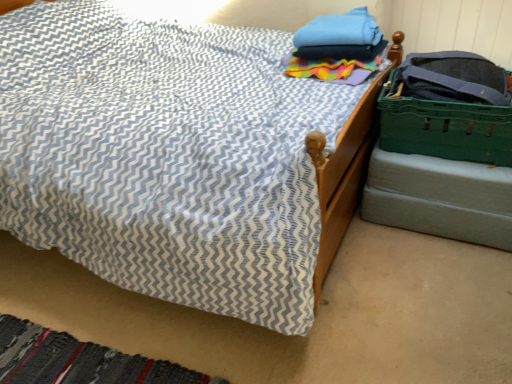
You are a GUI agent. You are given a task and a screenshot of the screen. Output one action in this format:
    pyautogui.click(x=<x>, y=<y>)
    Task: Click on the textured fabric bed at center
    This screenshot has height=384, width=512.
    Given the screenshot: What is the action you would take?
    pyautogui.click(x=166, y=155)

Does blue cotton towels at upper right turn towards green plastic crate at lower right?

No.

From a real-world perspective, between blue cotton towels at upper right and green plastic crate at lower right, who is vertically higher?

blue cotton towels at upper right.

Looking at this image, is blue cotton towels at upper right completely or partially outside of green plastic crate at lower right?

Yes, blue cotton towels at upper right is not within green plastic crate at lower right.

Image resolution: width=512 pixels, height=384 pixels. In order to click on clothing above the green plastic crate at lower right (from a real-world perspective) in this screenshot , I will do `click(337, 48)`.

Are green plastic crate at right and green plastic crate at lower right located far from each other?

No, green plastic crate at right is not far from green plastic crate at lower right.

Is green plastic crate at right inside or outside of green plastic crate at lower right?

green plastic crate at right exists outside the volume of green plastic crate at lower right.

Does green plastic crate at right turn towards green plastic crate at lower right?

No, green plastic crate at right does not turn towards green plastic crate at lower right.

Is point (510, 79) farther from viewer compared to point (433, 205)?

No, (510, 79) is in front of (433, 205).

Would you consider green plastic crate at lower right to be distant from textured fabric bed at center?

That's not correct — green plastic crate at lower right is a little close to textured fabric bed at center.

From a real-world perspective, between green plastic crate at lower right and textured fabric bed at center, who is vertically higher?

green plastic crate at lower right.

Is green plastic crate at lower right facing towards textured fabric bed at center?

No.

Is blue cotton towels at upper right turned away from textured fabric bed at center?

No, textured fabric bed at center is not at the back of blue cotton towels at upper right.

From the picture: Is blue cotton towels at upper right situated inside textured fabric bed at center or outside?

blue cotton towels at upper right exists outside the volume of textured fabric bed at center.

Does blue cotton towels at upper right appear on the right side of textured fabric bed at center?

Indeed, blue cotton towels at upper right is positioned on the right side of textured fabric bed at center.

From the image's perspective, is blue cotton towels at upper right on textured fabric bed at center?

Yes.

Does point (403, 101) come behind point (326, 68)?

No, (403, 101) is in front of (326, 68).

Can you confirm if green plastic crate at right is shorter than blue cotton towels at upper right?

Incorrect, the height of green plastic crate at right does not fall short of that of blue cotton towels at upper right.

Is green plastic crate at right with blue cotton towels at upper right?

green plastic crate at right and blue cotton towels at upper right are clearly separated.

From the image's perspective, is green plastic crate at right located above blue cotton towels at upper right?

No, from the image's perspective, green plastic crate at right is not on top of blue cotton towels at upper right.

Is the position of textured fabric bed at center more distant than that of blue cotton towels at upper right?

No, it is in front of blue cotton towels at upper right.

From the image's perspective, does textured fabric bed at center appear lower than blue cotton towels at upper right?

Correct, textured fabric bed at center appears lower than blue cotton towels at upper right in the image.

Is textured fabric bed at center aimed at blue cotton towels at upper right?

No, textured fabric bed at center is not facing towards blue cotton towels at upper right.

Is textured fabric bed at center inside or outside of blue cotton towels at upper right?

textured fabric bed at center is not inside blue cotton towels at upper right, it's outside.

Considering the sizes of objects textured fabric bed at center and green plastic crate at lower right in the image provided, who is thinner, textured fabric bed at center or green plastic crate at lower right?

With smaller width is green plastic crate at lower right.

Is textured fabric bed at center not inside green plastic crate at lower right?

textured fabric bed at center is positioned outside green plastic crate at lower right.

Is textured fabric bed at center aimed at green plastic crate at lower right?

No, textured fabric bed at center is not turned towards green plastic crate at lower right.

Identify the location of clothing on the left of the green plastic crate at lower right. (337, 48).

Locate an element on the screen. The height and width of the screenshot is (384, 512). bed frame that appears below the green plastic crate at right (from a real-world perspective) is located at coordinates (440, 198).

Based on their spatial positions, is green plastic crate at right or textured fabric bed at center further from green plastic crate at lower right?

textured fabric bed at center.

From the image, which object appears to be nearer to textured fabric bed at center, blue cotton towels at upper right or green plastic crate at right?

blue cotton towels at upper right is positioned closer to the anchor textured fabric bed at center.

From the image, which object appears to be farther from textured fabric bed at center, green plastic crate at lower right or blue cotton towels at upper right?

Based on the image, green plastic crate at lower right appears to be further to textured fabric bed at center.

Which object lies nearer to the anchor point textured fabric bed at center, green plastic crate at right or green plastic crate at lower right?

green plastic crate at right is positioned closer to the anchor textured fabric bed at center.

When comparing their distances from green plastic crate at right, does textured fabric bed at center or green plastic crate at lower right seem closer?

green plastic crate at lower right is closer to green plastic crate at right.

Which object lies further to the anchor point blue cotton towels at upper right, green plastic crate at right or textured fabric bed at center?

textured fabric bed at center.

Which object lies further to the anchor point green plastic crate at right, green plastic crate at lower right or blue cotton towels at upper right?

blue cotton towels at upper right is positioned further to the anchor green plastic crate at right.

Looking at the image, which one is located further to green plastic crate at right, blue cotton towels at upper right or textured fabric bed at center?

The object further to green plastic crate at right is textured fabric bed at center.

Identify the location of basket between textured fabric bed at center and blue cotton towels at upper right from front to back. The image size is (512, 384). (445, 128).

Where is `bed frame between textured fabric bed at center and blue cotton towels at upper right from front to back`? This screenshot has width=512, height=384. bed frame between textured fabric bed at center and blue cotton towels at upper right from front to back is located at coordinates (440, 198).

At what (x,y) coordinates should I click in order to perform the action: click on basket between blue cotton towels at upper right and green plastic crate at lower right in the up-down direction. Please return your answer as a coordinate pair (x, y). Looking at the image, I should click on (445, 128).

The height and width of the screenshot is (384, 512). I want to click on basket between textured fabric bed at center and green plastic crate at lower right from left to right, so [x=445, y=128].